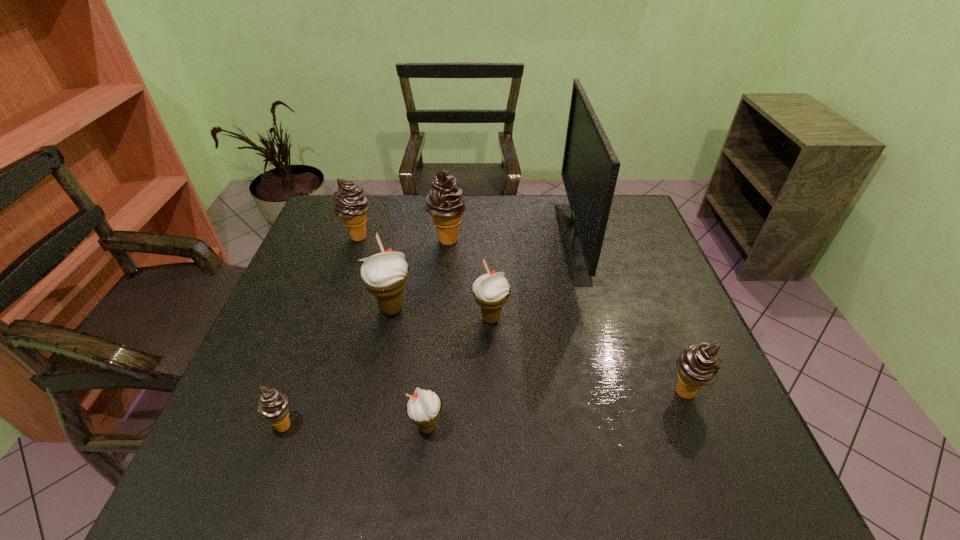
Locate an element on the screen. Image resolution: width=960 pixels, height=540 pixels. vacant space that is in between the second biggest chocolate icecream and the third farthest chocolate icecream is located at coordinates (522, 315).

In order to click on vacant space that is in between the nearest white icecream and the nearest chocolate icecream in this screenshot , I will do `click(355, 427)`.

At what (x,y) coordinates should I click in order to perform the action: click on vacant point located between the rightmost icecream and the third chocolate icecream from left to right. Please return your answer as a coordinate pair (x, y). This screenshot has height=540, width=960. Looking at the image, I should click on (566, 316).

Identify which object is the fourth nearest to the fifth icecream from right to left. Please provide its 2D coordinates. Your answer should be formatted as a tuple, i.e. [(x, y)], where the tuple contains the x and y coordinates of a point satisfying the conditions above.

[(423, 408)]

Identify which object is the seventh closest to the second object from right to left. Please provide its 2D coordinates. Your answer should be formatted as a tuple, i.e. [(x, y)], where the tuple contains the x and y coordinates of a point satisfying the conditions above.

[(273, 407)]

Identify the location of icecream that is the second closest to the tallest icecream. Image resolution: width=960 pixels, height=540 pixels. (385, 275).

Locate an element on the screen. The image size is (960, 540). icecream that is the closest to the second biggest chocolate icecream is located at coordinates (445, 203).

Locate which chocolate icecream ranks second in proximity to the biggest chocolate icecream. Please provide its 2D coordinates. Your answer should be formatted as a tuple, i.e. [(x, y)], where the tuple contains the x and y coordinates of a point satisfying the conditions above.

[(273, 407)]

Image resolution: width=960 pixels, height=540 pixels. In order to click on chocolate icecream that is the second closest to the third smallest chocolate icecream in this screenshot , I will do `click(273, 407)`.

Where is `the second closest white icecream relative to the second biggest chocolate icecream`? the second closest white icecream relative to the second biggest chocolate icecream is located at coordinates (491, 291).